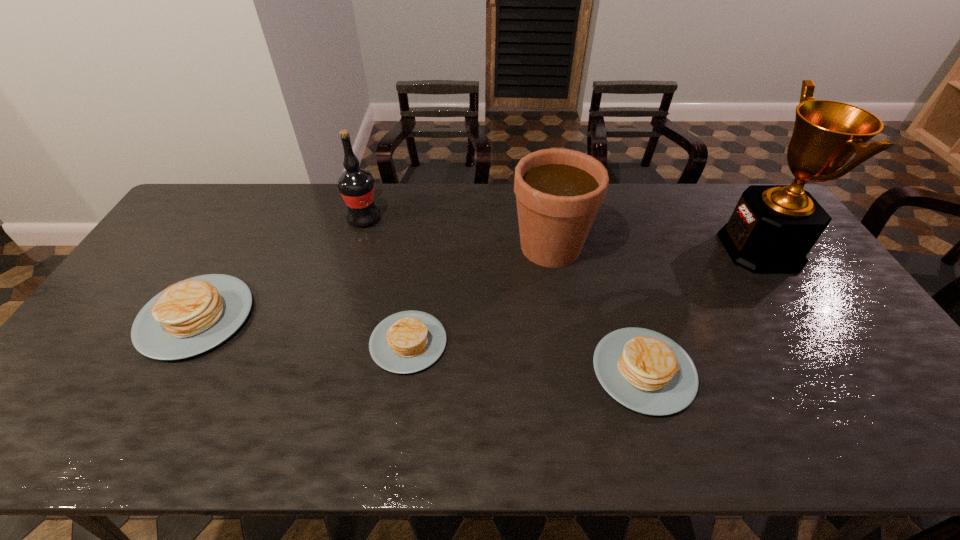
The image size is (960, 540). I want to click on free space located 0.080m on the front of the tallest pancake, so click(153, 392).

You are a GUI agent. You are given a task and a screenshot of the screen. Output one action in this format:
    pyautogui.click(x=<x>, y=<y>)
    Task: Click on the vacant space located 0.060m on the back of the third object from left to right
    This screenshot has height=540, width=960.
    Given the screenshot: What is the action you would take?
    pyautogui.click(x=415, y=296)

Find the location of a particular element. This screenshot has width=960, height=540. vacant space located 0.190m on the back of the rightmost pancake is located at coordinates (616, 279).

This screenshot has height=540, width=960. I want to click on vacant region located 0.180m on the back of the third tallest object, so click(x=541, y=191).

Where is `vacant space located on the front of the tallest object with the label`? This screenshot has width=960, height=540. vacant space located on the front of the tallest object with the label is located at coordinates (674, 249).

The width and height of the screenshot is (960, 540). Find the location of `vacant position located 0.150m on the front of the tallest object with the label`. vacant position located 0.150m on the front of the tallest object with the label is located at coordinates (678, 249).

Locate an element on the screen. The width and height of the screenshot is (960, 540). vacant region located on the front of the tallest object with the label is located at coordinates (609, 249).

What are the coordinates of `free space located on the left of the second object from left to right` in the screenshot? It's located at (312, 219).

Where is `flowerpot at the far edge`? flowerpot at the far edge is located at coordinates (558, 192).

Where is `trophy cup located in the far edge section of the desktop`? The image size is (960, 540). trophy cup located in the far edge section of the desktop is located at coordinates (772, 229).